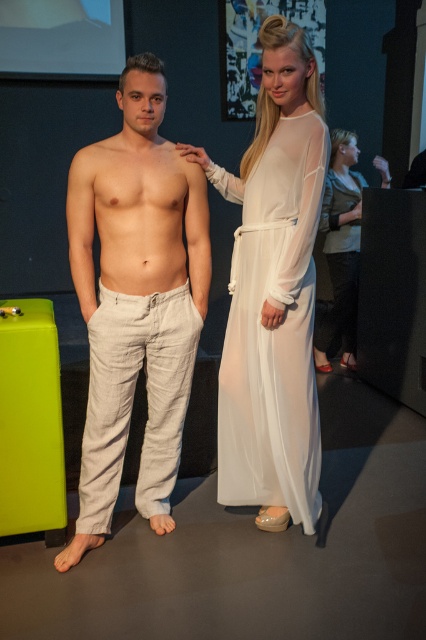
Measure the distance from light beige linen pants at left to beige linen pants at center.

light beige linen pants at left and beige linen pants at center are 2.98 inches apart.

Is light beige linen pants at left wider than beige linen pants at center?

Yes.

I want to click on light beige linen pants at left, so click(x=135, y=300).

Is light beige linen pants at center to the left of silky white dress at center from the viewer's perspective?

Correct, you'll find light beige linen pants at center to the left of silky white dress at center.

Is point (140, 88) farther from camera compared to point (385, 177)?

That is False.

Is point (80, 196) positioned behind point (330, 321)?

No, it is in front of (330, 321).

Where is `light beige linen pants at center`? The width and height of the screenshot is (426, 640). light beige linen pants at center is located at coordinates (138, 204).

Which is in front, point (250, 432) or point (344, 316)?

Positioned in front is point (250, 432).

Who is positioned more to the left, white sheer dress at center or silky white dress at center?

white sheer dress at center is more to the left.

Describe the element at coordinates (273, 328) in the screenshot. I see `white sheer dress at center` at that location.

At what (x,y) coordinates should I click in order to perform the action: click on white sheer dress at center. Please return your answer as a coordinate pair (x, y). Image resolution: width=426 pixels, height=640 pixels. Looking at the image, I should click on (273, 328).